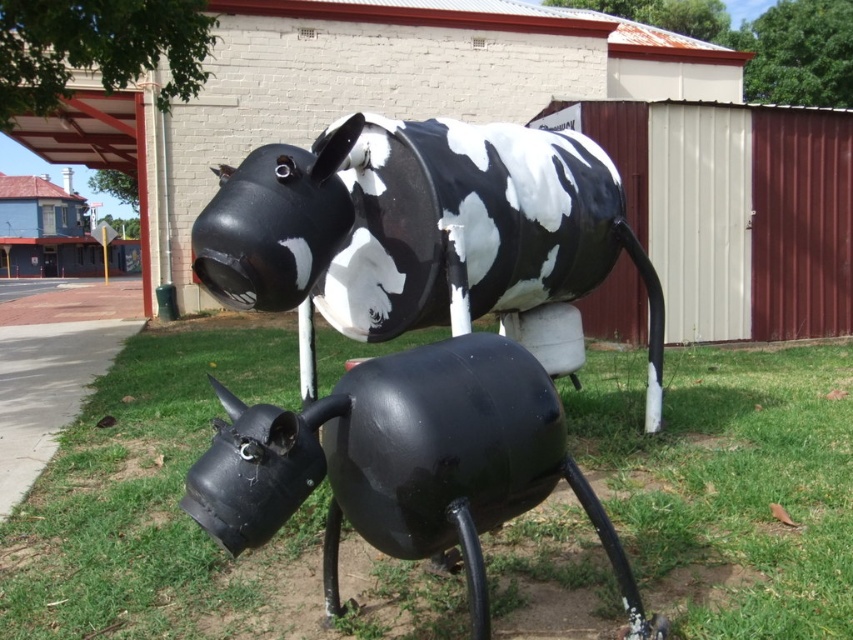
Is green grass at lower center above glossy black cow at lower center?

No.

Does green grass at lower center have a lesser height compared to glossy black cow at lower center?

Correct, green grass at lower center is not as tall as glossy black cow at lower center.

Is point (340, 554) closer to camera compared to point (310, 460)?

No, it is behind (310, 460).

This screenshot has width=853, height=640. I want to click on green grass at lower center, so click(187, 516).

This screenshot has width=853, height=640. What do you see at coordinates (187, 516) in the screenshot?
I see `green grass at lower center` at bounding box center [187, 516].

Can you confirm if green grass at lower center is thinner than black matte cow at center?

Yes.

Locate an element on the screen. The width and height of the screenshot is (853, 640). green grass at lower center is located at coordinates (187, 516).

Does point (222, 250) lie in front of point (265, 435)?

No, it is not.

Between point (227, 182) and point (184, 496), which one is positioned in front?

Positioned in front is point (184, 496).

At what (x,y) coordinates should I click in order to perform the action: click on black matte cow at center. Please return your answer as a coordinate pair (x, y). Looking at the image, I should click on tap(421, 228).